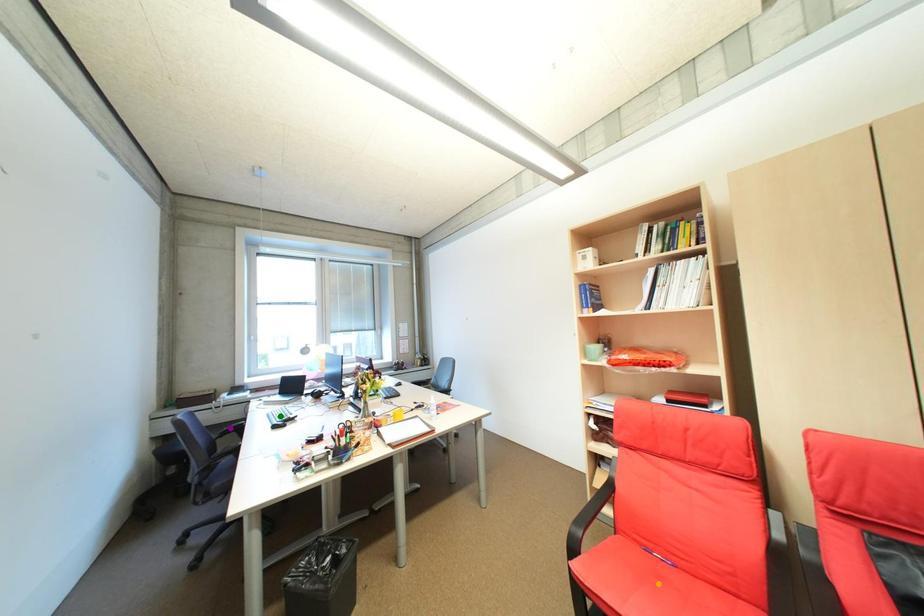
Order these from farthest to nearest:
orange point, green point, purple point

green point < purple point < orange point